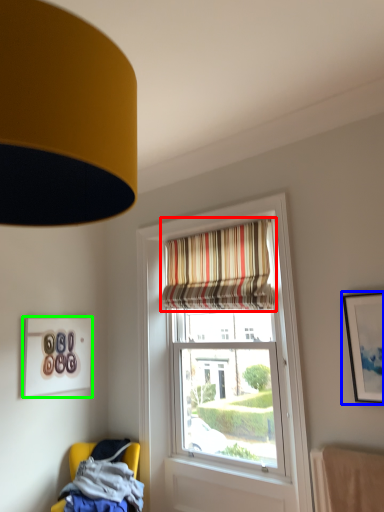
Question: Based on their relative distances, which object is farther from curtain (highlighted by a red box)? Choose from picture frame (highlighted by a blue box) and picture frame (highlighted by a green box).

Choices:
 (A) picture frame
 (B) picture frame

Answer: (B)